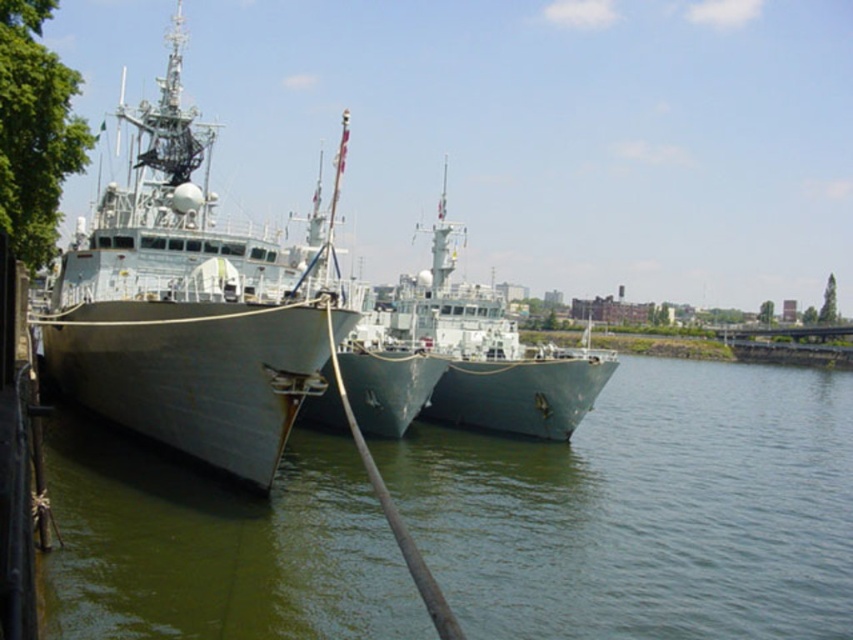
Who is more distant from viewer, (157, 301) or (381, 285)?

The point (381, 285) is behind.

Is metallic gray ship at left bigger than green matte ship at center?

Yes.

The image size is (853, 640). What are the coordinates of `metallic gray ship at left` in the screenshot? It's located at (183, 307).

Which is more to the right, greenish water at center or metallic gray ship at left?

From the viewer's perspective, greenish water at center appears more on the right side.

From the picture: Can you confirm if greenish water at center is shorter than metallic gray ship at left?

Yes.

Who is more forward, (466, 516) or (73, 356)?

Positioned in front is point (466, 516).

The height and width of the screenshot is (640, 853). I want to click on greenish water at center, so click(x=647, y=509).

In the scene shown: Measure the distance from greenish water at center to green matte ship at center.

greenish water at center and green matte ship at center are 23.36 meters apart.

Measure the distance from greenish water at center to green matte ship at center.

greenish water at center is 23.36 meters from green matte ship at center.

Where is `greenish water at center`? The height and width of the screenshot is (640, 853). greenish water at center is located at coordinates (647, 509).